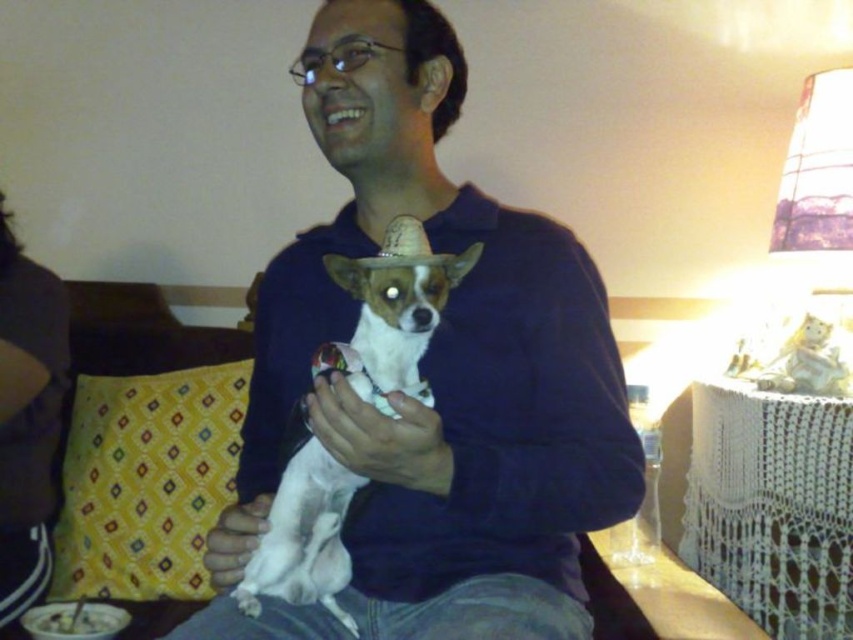
You are standing in the living room and see two points marked in the image. The first point is at coordinate point (199, 621) and the second is at point (77, 432). Which point is closer to you?

Point (199, 621) is in front of point (77, 432), so it is closer to you.